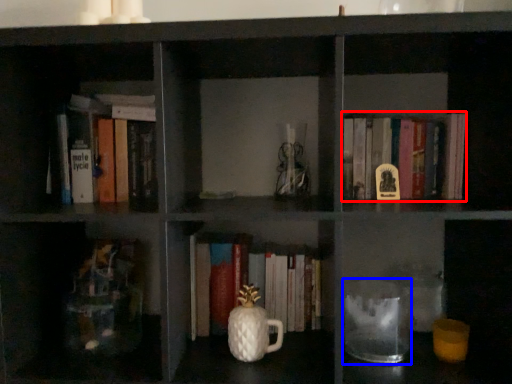
Question: Which object appears farthest to the camera in this image, book (highlighted by a red box) or glass jar (highlighted by a blue box)?

Choices:
 (A) book
 (B) glass jar

Answer: (A)